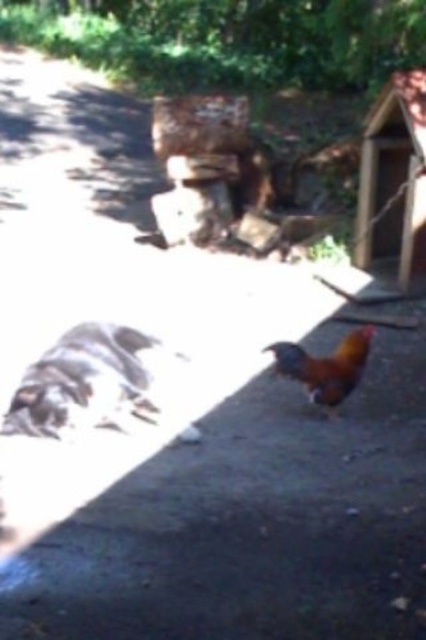
Question: Is brown feathered chicken at center positioned in front of rusty metallic rooster at center?

Choices:
 (A) yes
 (B) no

Answer: (A)

Question: Which of the following is the farthest from the observer?

Choices:
 (A) (373, 330)
 (B) (115, 369)

Answer: (A)

Question: Among these points, which one is farthest from the camera?

Choices:
 (A) (89, 332)
 (B) (307, 369)

Answer: (A)

Question: Does brown feathered chicken at center have a lesser width compared to rusty metallic rooster at center?

Choices:
 (A) yes
 (B) no

Answer: (B)

Question: In this image, where is brown feathered chicken at center located relative to rusty metallic rooster at center?

Choices:
 (A) left
 (B) right

Answer: (A)